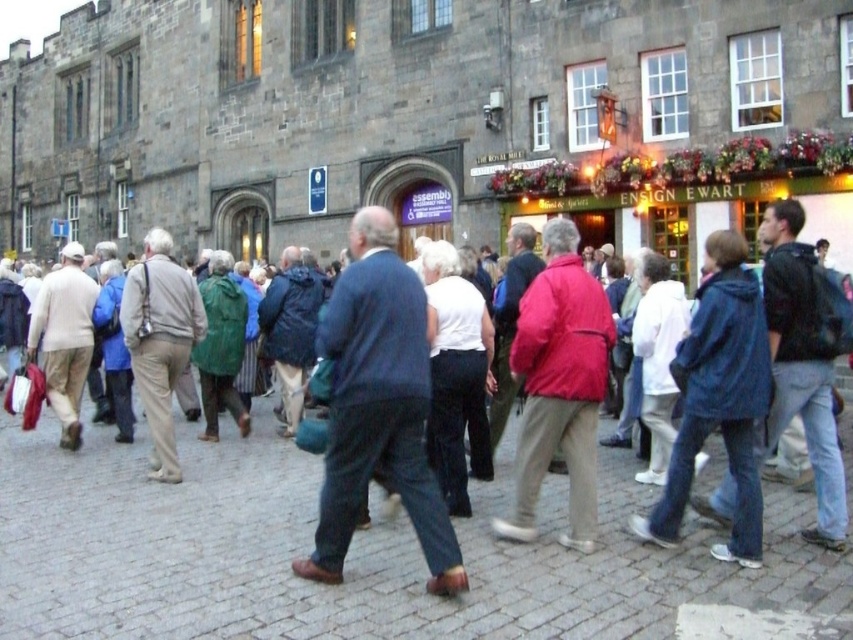
You are a photographer trying to capture a clear shot of both the blue fabric jacket at center and the red matte jacket at center in the scene. Since you want both subjects to be fully visible, which jacket should you focus on first to ensure the taller one is in frame?

The blue fabric jacket at center is taller than the red matte jacket at center, so you should focus on the blue fabric jacket at center first to ensure it is fully in frame before adjusting for the shorter one.

You are standing at the entrance of the Ensign Ewart pub and need to reach a friend who is at point (x=579, y=488). There is an obstacle at point (x=270, y=637). Can you walk directly to your friend without going around the obstacle?

Point (x=270, y=637) is in front of point (x=579, y=488), so you cannot walk directly to your friend at point (x=579, y=488) without going around the obstacle at point (x=270, y=637).